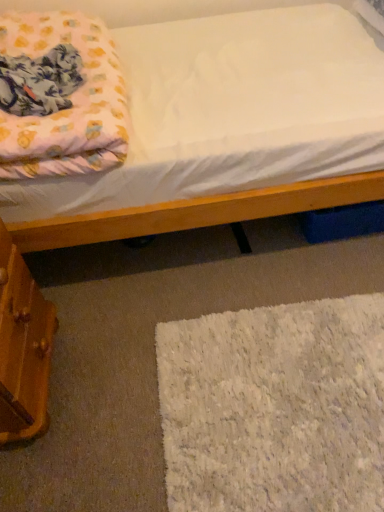
Find the location of `free space above white fluffy rug at lower right (from a real-world perspective)`. free space above white fluffy rug at lower right (from a real-world perspective) is located at coordinates [x=269, y=390].